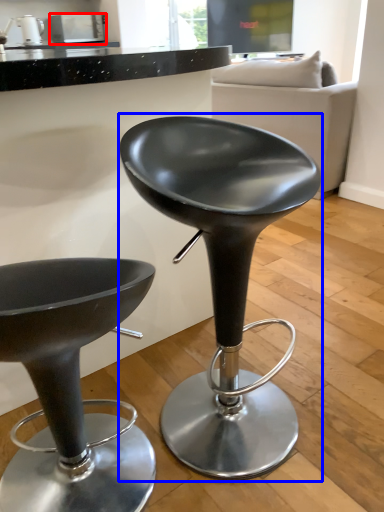
Question: Which object appears closest to the camera in this image, appliance (highlighted by a red box) or chair (highlighted by a blue box)?

Choices:
 (A) appliance
 (B) chair

Answer: (B)